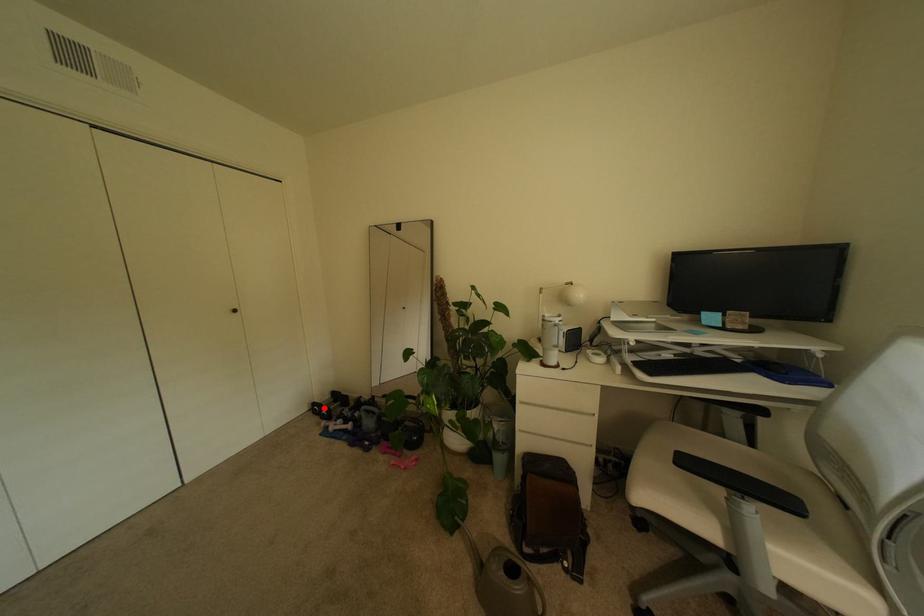
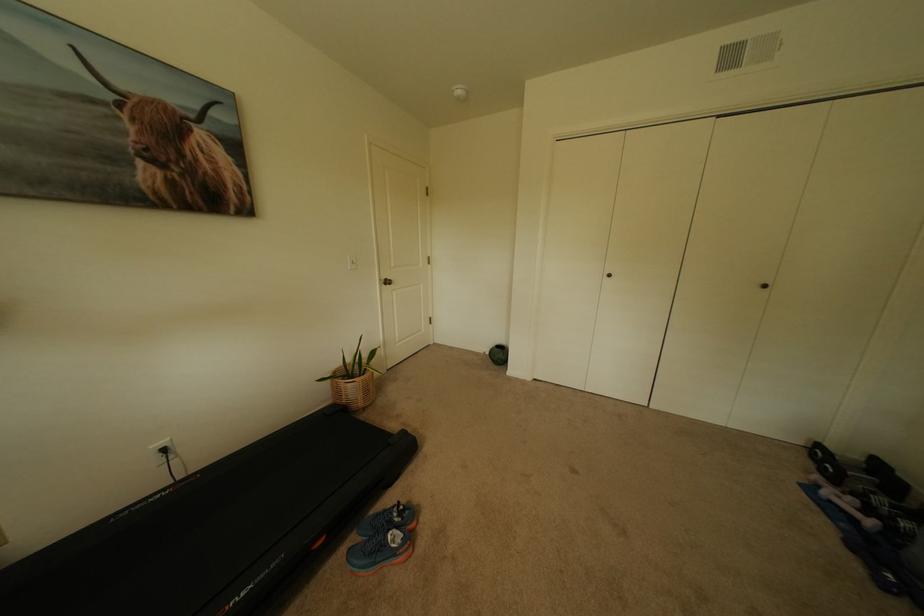
Question: I am providing you with two images of the same scene from different viewpoints. Image1 has a red point marked. In image2, the corresponding 3D location appears at what relative position? Reply with the corresponding letter.

Choices:
 (A) Closer
 (B) Farther

Answer: (A)